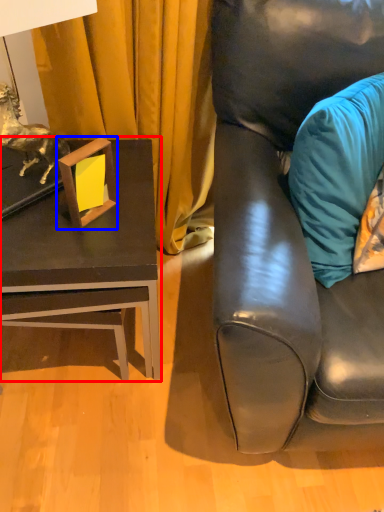
Question: Which point is closer to the camera, table (highlighted by a red box) or picture frame (highlighted by a blue box)?

Choices:
 (A) table
 (B) picture frame

Answer: (B)